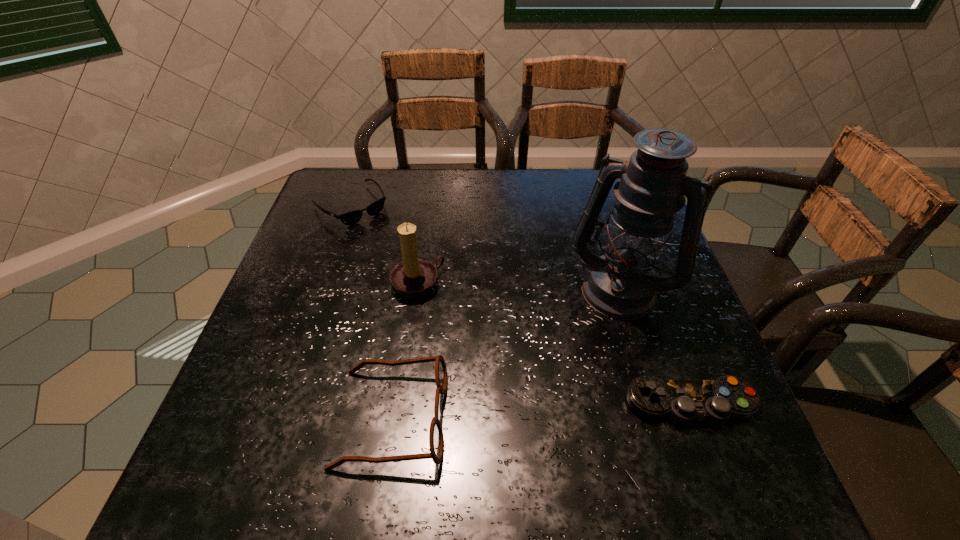
Where is `object present at the left edge`? object present at the left edge is located at coordinates (352, 217).

The width and height of the screenshot is (960, 540). Find the location of `control that is positioned at the right edge`. control that is positioned at the right edge is located at coordinates pos(682,401).

In order to click on lantern at the right edge in this screenshot , I will do `click(621, 284)`.

Locate an element on the screen. This screenshot has height=540, width=960. object that is at the far left corner is located at coordinates (352, 217).

Where is `object present at the near right corner`? object present at the near right corner is located at coordinates (682, 401).

Where is `free region at the far edge`? free region at the far edge is located at coordinates (514, 201).

You are a GUI agent. You are given a task and a screenshot of the screen. Output one action in this format:
    pyautogui.click(x=<x>, y=<y>)
    Task: Click on the vacant area at the near edge
    This screenshot has width=960, height=540.
    Given the screenshot: What is the action you would take?
    pyautogui.click(x=414, y=419)

What are the coordinates of `vacant space at the left edge of the desktop` in the screenshot? It's located at (319, 298).

Find the location of a particular element. Image resolution: width=960 pixels, height=540 pixels. free space at the right edge of the desktop is located at coordinates (670, 369).

You are a GUI agent. You are given a task and a screenshot of the screen. Output one action in this format:
    pyautogui.click(x=<x>, y=<y>)
    Task: Click on the free space at the far left corner of the desktop
    This screenshot has width=960, height=540.
    Given the screenshot: What is the action you would take?
    pyautogui.click(x=337, y=194)